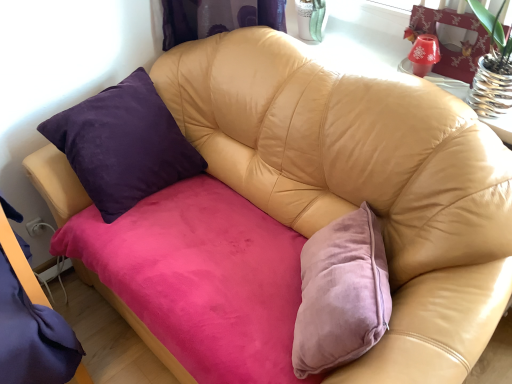
Where is `translucent glass vase at upper right`? The width and height of the screenshot is (512, 384). translucent glass vase at upper right is located at coordinates (452, 44).

The width and height of the screenshot is (512, 384). Describe the element at coordinates (452, 44) in the screenshot. I see `translucent glass vase at upper right` at that location.

Where is `purple velvet bed frame at left`? purple velvet bed frame at left is located at coordinates (33, 330).

Describe the element at coordinates (33, 330) in the screenshot. I see `purple velvet bed frame at left` at that location.

Where is `translucent glass vase at upper right`? translucent glass vase at upper right is located at coordinates (452, 44).

Which is more to the left, translucent glass vase at upper right or purple velvet bed frame at left?

Positioned to the left is purple velvet bed frame at left.

Considering the positions of objects translucent glass vase at upper right and purple velvet bed frame at left in the image provided, who is in front, translucent glass vase at upper right or purple velvet bed frame at left?

purple velvet bed frame at left is in front.

Which point is more distant from viewer, (x=481, y=42) or (x=16, y=341)?

The point (x=481, y=42) is farther.

From the image's perspective, which one is positioned lower, translucent glass vase at upper right or purple velvet bed frame at left?

From the image's view, purple velvet bed frame at left is below.

From a real-world perspective, between translucent glass vase at upper right and purple velvet bed frame at left, who is vertically higher?

translucent glass vase at upper right is physically above.

Considering the relative sizes of translucent glass vase at upper right and purple velvet bed frame at left in the image provided, is translucent glass vase at upper right thinner than purple velvet bed frame at left?

Correct, the width of translucent glass vase at upper right is less than that of purple velvet bed frame at left.

In terms of height, does translucent glass vase at upper right look taller or shorter compared to purple velvet bed frame at left?

Considering their sizes, translucent glass vase at upper right has less height than purple velvet bed frame at left.

Between translucent glass vase at upper right and purple velvet bed frame at left, which one has smaller size?

translucent glass vase at upper right.

Is purple velvet bed frame at left inside translucent glass vase at upper right?

Actually, purple velvet bed frame at left is outside translucent glass vase at upper right.

From the picture: Are translucent glass vase at upper right and purple velvet bed frame at left making contact?

There is a gap between translucent glass vase at upper right and purple velvet bed frame at left.

Is translucent glass vase at upper right oriented away from purple velvet bed frame at left?

No, translucent glass vase at upper right is not facing the opposite direction of purple velvet bed frame at left.

Measure the distance from translucent glass vase at upper right to purple velvet bed frame at left.

translucent glass vase at upper right and purple velvet bed frame at left are 1.37 meters apart.

Find the location of a particular element. swivel chair above the purple velvet bed frame at left (from the image's perspective) is located at coordinates pyautogui.click(x=452, y=44).

Does purple velvet bed frame at left appear on the left side of translucent glass vase at upper right?

Correct, you'll find purple velvet bed frame at left to the left of translucent glass vase at upper right.

Which object is closer to the camera taking this photo, purple velvet bed frame at left or translucent glass vase at upper right?

purple velvet bed frame at left is closer to the camera.

Between point (51, 363) and point (448, 21), which one is positioned behind?

The point (448, 21) is more distant.

From the picture: From the image's perspective, which is above, purple velvet bed frame at left or translucent glass vase at upper right?

translucent glass vase at upper right is shown above in the image.

Looking at this image, from a real-world perspective, is purple velvet bed frame at left positioned above or below translucent glass vase at upper right?

purple velvet bed frame at left is situated lower than translucent glass vase at upper right in the real world.

Does purple velvet bed frame at left have a greater width compared to translucent glass vase at upper right?

Correct, the width of purple velvet bed frame at left exceeds that of translucent glass vase at upper right.

Considering the sizes of purple velvet bed frame at left and translucent glass vase at upper right in the image, is purple velvet bed frame at left taller or shorter than translucent glass vase at upper right?

Clearly, purple velvet bed frame at left is taller compared to translucent glass vase at upper right.

Considering the relative sizes of purple velvet bed frame at left and translucent glass vase at upper right in the image provided, is purple velvet bed frame at left bigger than translucent glass vase at upper right?

Correct, purple velvet bed frame at left is larger in size than translucent glass vase at upper right.

Do you think purple velvet bed frame at left is within translucent glass vase at upper right, or outside of it?

purple velvet bed frame at left is spatially situated outside translucent glass vase at upper right.

Would you consider purple velvet bed frame at left to be distant from translucent glass vase at upper right?

Yes, purple velvet bed frame at left and translucent glass vase at upper right are quite far apart.

Is purple velvet bed frame at left aimed at translucent glass vase at upper right?

No, purple velvet bed frame at left is not aimed at translucent glass vase at upper right.

At what (x,y) coordinates should I click in order to perform the action: click on bed frame on the left of translucent glass vase at upper right. Please return your answer as a coordinate pair (x, y). The width and height of the screenshot is (512, 384). Looking at the image, I should click on (33, 330).

Where is `swivel chair that appears behind the purple velvet bed frame at left`? The width and height of the screenshot is (512, 384). swivel chair that appears behind the purple velvet bed frame at left is located at coordinates (452, 44).

You are a GUI agent. You are given a task and a screenshot of the screen. Output one action in this format:
    pyautogui.click(x=<x>, y=<y>)
    Task: Click on the bed frame in front of the translucent glass vase at upper right
    Image resolution: width=512 pixels, height=384 pixels.
    Given the screenshot: What is the action you would take?
    pyautogui.click(x=33, y=330)